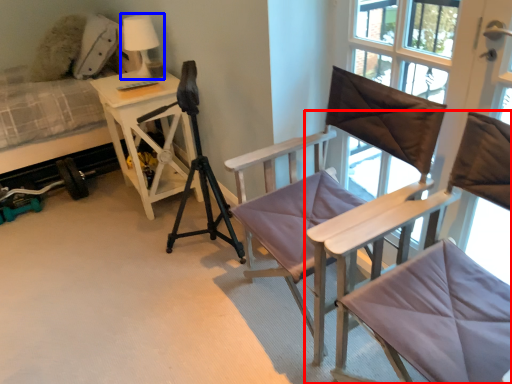
Question: Which object appears closest to the camera in this image, chair (highlighted by a red box) or table lamp (highlighted by a blue box)?

Choices:
 (A) chair
 (B) table lamp

Answer: (A)